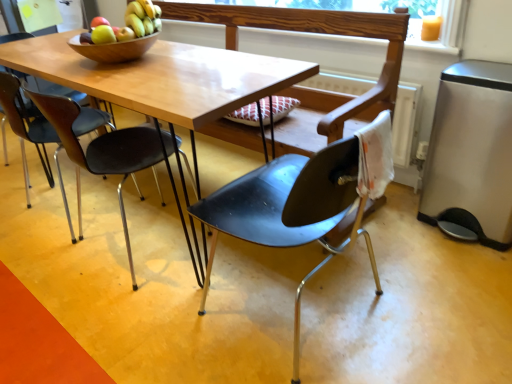
Where is `empty space that is ontop of black plastic chair at left, which appears as the second chair when viewed from the right (from a real-world perspective)`? empty space that is ontop of black plastic chair at left, which appears as the second chair when viewed from the right (from a real-world perspective) is located at coordinates pos(109,71).